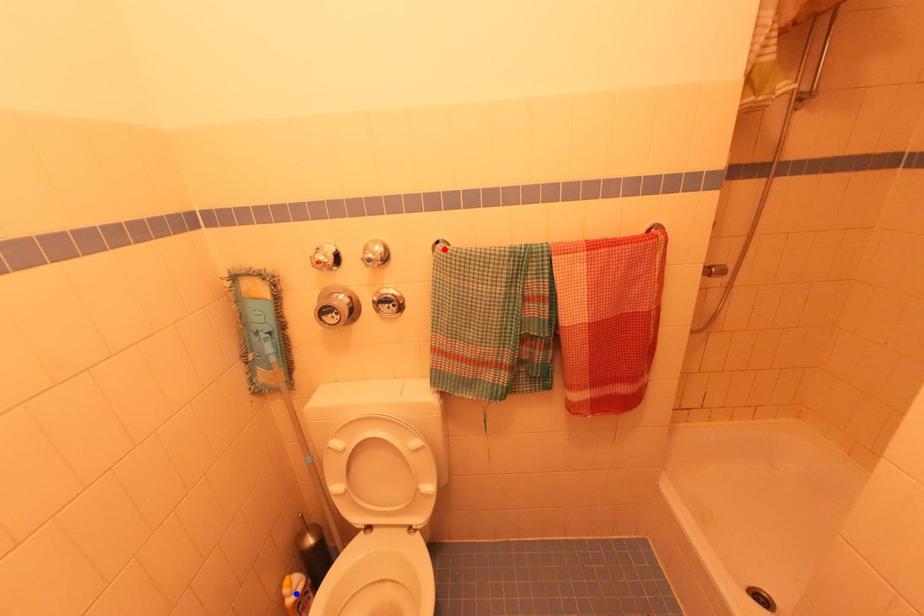
Question: Which of the two points in the image is closer to the camera?

Choices:
 (A) Blue point is closer.
 (B) Red point is closer.

Answer: (B)